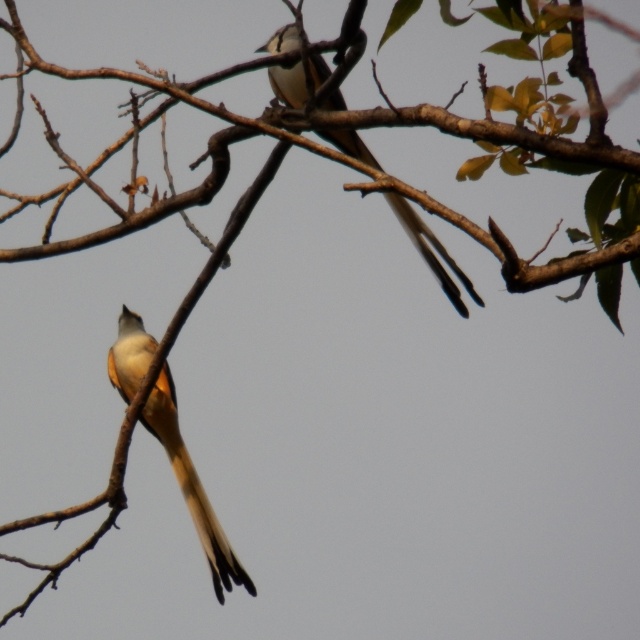
Question: Observing the image, what is the correct spatial positioning of light brown feathered tail at lower left in reference to white-feathered bird at upper center?

Choices:
 (A) below
 (B) above

Answer: (A)

Question: Based on their relative distances, which object is farther from the light brown feathered tail at lower left?

Choices:
 (A) white-feathered bird at upper center
 (B) yellowish-brown feathered tail at lower center

Answer: (A)

Question: Which point is farther to the camera?

Choices:
 (A) (248, 573)
 (B) (220, 532)
 (C) (301, 77)

Answer: (B)

Question: Does white-feathered bird at upper center have a lesser width compared to yellowish-brown feathered tail at lower center?

Choices:
 (A) no
 (B) yes

Answer: (A)

Question: Does light brown feathered tail at lower left appear under yellowish-brown feathered tail at lower center?

Choices:
 (A) yes
 (B) no

Answer: (B)

Question: Which point is closer to the camera?

Choices:
 (A) (401, 204)
 (B) (168, 440)
 (C) (214, 586)

Answer: (A)